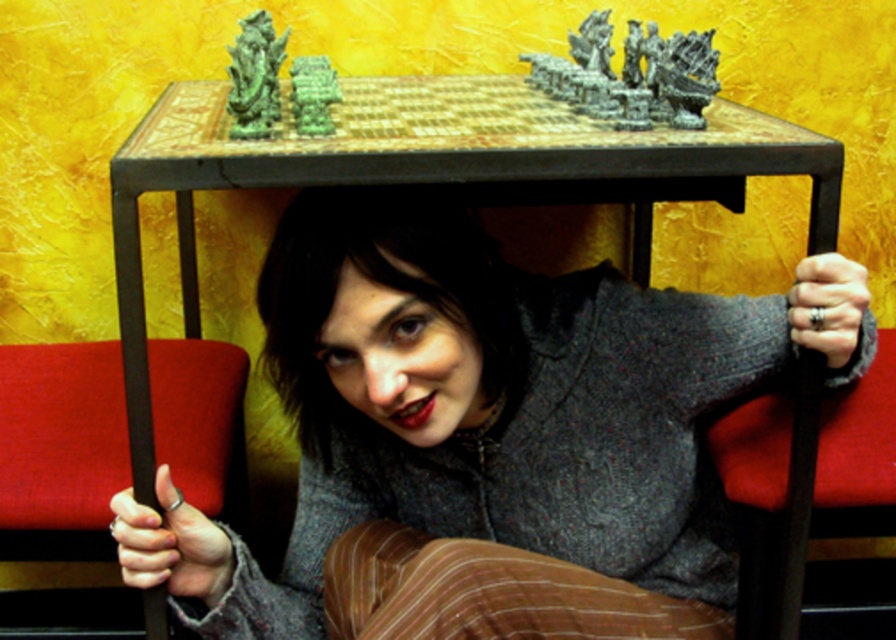
Question: Is brown leather chair at lower left in front of dark wood chair at lower right?

Choices:
 (A) yes
 (B) no

Answer: (A)

Question: Is rustic wooden table at center smaller than brown leather chair at lower left?

Choices:
 (A) no
 (B) yes

Answer: (A)

Question: Considering the real-world distances, which object is closest to the brown leather chair at lower left?

Choices:
 (A) dark wood chair at lower right
 (B) rustic wooden table at center

Answer: (B)

Question: Estimate the real-world distances between objects in this image. Which object is farther from the rustic wooden table at center?

Choices:
 (A) dark wood chair at lower right
 (B) brown leather chair at lower left

Answer: (B)

Question: Among these objects, which one is farthest from the camera?

Choices:
 (A) dark wood chair at lower right
 (B) rustic wooden table at center
 (C) brown leather chair at lower left

Answer: (A)

Question: Does rustic wooden table at center appear over brown leather chair at lower left?

Choices:
 (A) yes
 (B) no

Answer: (A)